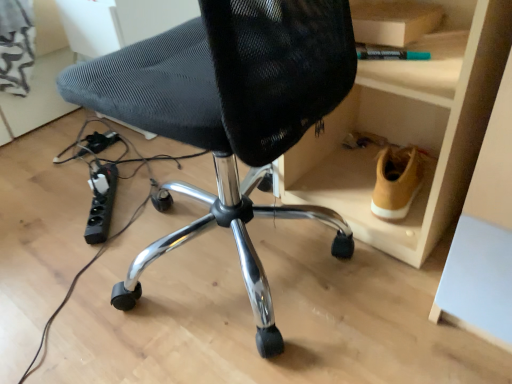
Question: Does point (225, 180) appear closer or farther from the camera than point (103, 241)?

Choices:
 (A) farther
 (B) closer

Answer: (B)

Question: In terms of height, does black mesh chair at center look taller or shorter compared to black plastic power strip at lower left, the first plug viewed from the front?

Choices:
 (A) tall
 (B) short

Answer: (A)

Question: Which object is positioned closest to the black plastic plug at lower left, acting as the first plug starting from the top?

Choices:
 (A) black mesh chair at center
 (B) black plastic power strip at lower left, the first plug viewed from the front
 (C) tan suede shoe at lower right

Answer: (B)

Question: Based on their relative distances, which object is nearer to the black plastic plug at lower left, placed as the first plug when sorted from back to front?

Choices:
 (A) black mesh chair at center
 (B) tan suede shoe at lower right
 (C) black plastic power strip at lower left, the first plug viewed from the front

Answer: (C)